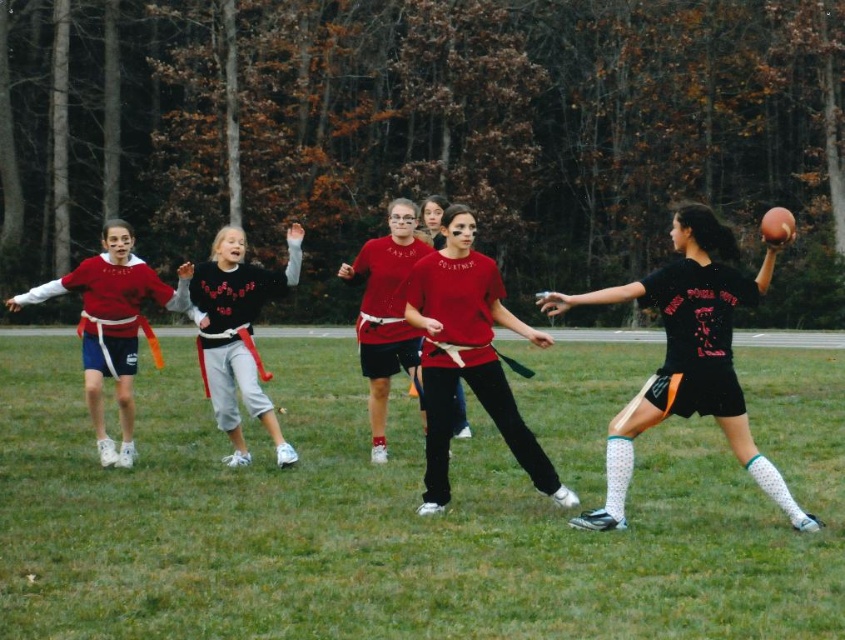
Question: Is the position of black matte jersey at right less distant than that of black fleece sweatshirt at center?

Choices:
 (A) no
 (B) yes

Answer: (B)

Question: Which object appears closest to the camera in this image?

Choices:
 (A) matte red jersey at left
 (B) matte red shirt at center
 (C) black fleece sweatshirt at center

Answer: (B)

Question: Among these objects, which one is farthest from the camera?

Choices:
 (A) green grass football field at center
 (B) matte red jersey at left

Answer: (B)

Question: Which object is positioned farthest from the black matte jersey at right?

Choices:
 (A) matte red jersey at left
 (B) black fleece sweatshirt at center

Answer: (A)

Question: Can you confirm if green grass football field at center is positioned below matte red shirt at center?

Choices:
 (A) no
 (B) yes

Answer: (B)

Question: Can you confirm if green grass football field at center is bigger than matte red shirt at center?

Choices:
 (A) no
 (B) yes

Answer: (B)